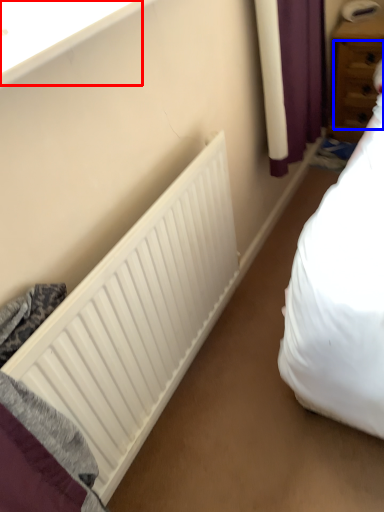
Question: Which of the following is the closest to the observer, window sill (highlighted by a red box) or drawer (highlighted by a blue box)?

Choices:
 (A) window sill
 (B) drawer

Answer: (A)